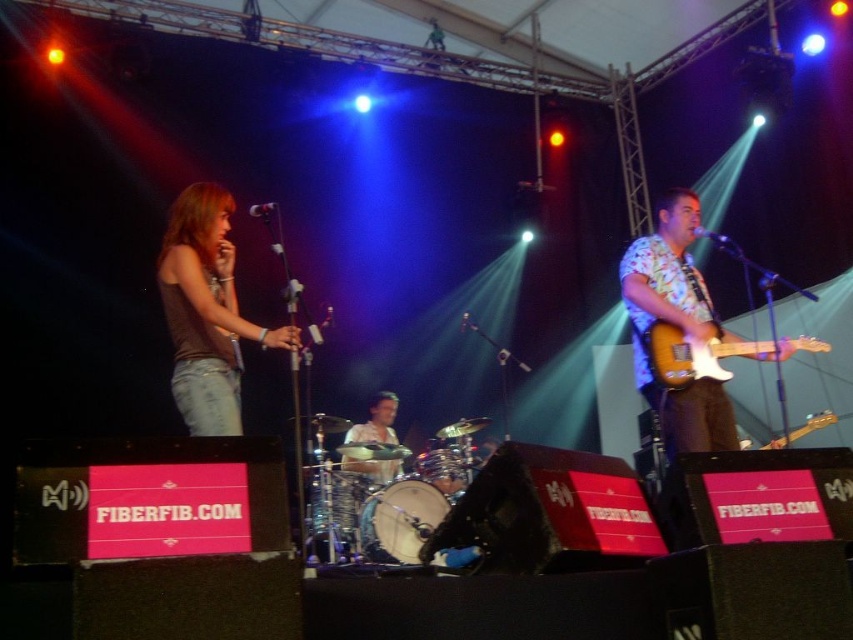
Find the location of `brown denim jeans at left`. brown denim jeans at left is located at coordinates (206, 310).

From the picture: Between brown denim jeans at left and floral fabric guitar at right, which one appears on the left side from the viewer's perspective?

Positioned to the left is brown denim jeans at left.

Describe the element at coordinates (206, 310) in the screenshot. I see `brown denim jeans at left` at that location.

The image size is (853, 640). In order to click on brown denim jeans at left in this screenshot , I will do `click(206, 310)`.

Can you confirm if brown denim jeans at left is taller than smooth skin drum at center?

Indeed, brown denim jeans at left has a greater height compared to smooth skin drum at center.

I want to click on brown denim jeans at left, so click(206, 310).

Where is `brown denim jeans at left`? The width and height of the screenshot is (853, 640). brown denim jeans at left is located at coordinates (206, 310).

Can you confirm if floral fabric guitar at right is taller than wooden electric guitar at right?

Yes, floral fabric guitar at right is taller than wooden electric guitar at right.

Is floral fabric guitar at right shorter than wooden electric guitar at right?

No.

Does point (695, 385) lie in front of point (828, 412)?

Yes, point (695, 385) is closer to viewer.

The width and height of the screenshot is (853, 640). Find the location of `floral fabric guitar at right`. floral fabric guitar at right is located at coordinates (675, 326).